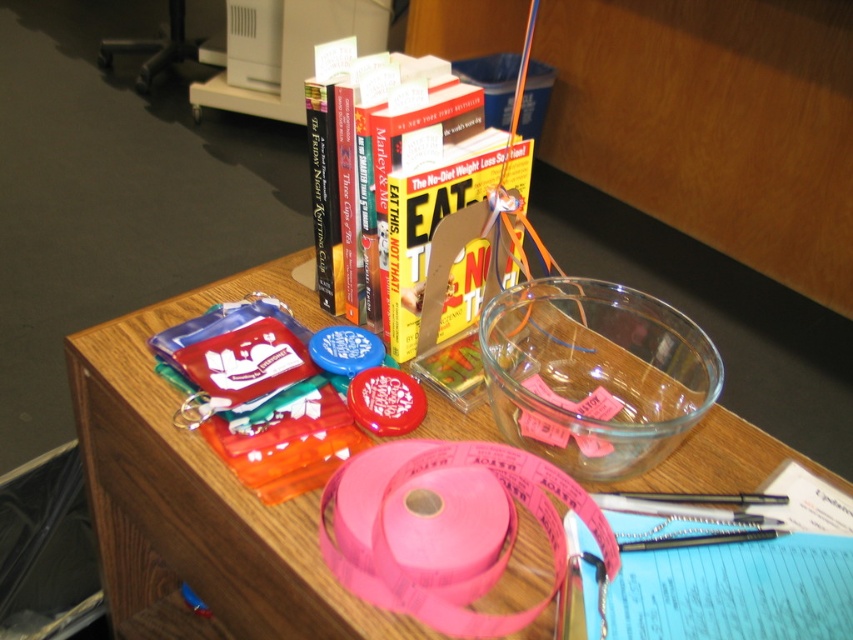
Question: Observing the image, what is the correct spatial positioning of pink plastic tape at center in reference to pink paper ribbon at center?

Choices:
 (A) left
 (B) right

Answer: (A)

Question: Can you confirm if pink paper ribbon at center is thinner than hardcover book at center?

Choices:
 (A) no
 (B) yes

Answer: (A)

Question: Which of these objects is positioned closest to the hardcover book at center?

Choices:
 (A) pink plastic tape at center
 (B) pink paper ribbon at center

Answer: (B)

Question: Which object appears closest to the camera in this image?

Choices:
 (A) transparent glass bowl at center
 (B) pink plastic tape at center

Answer: (B)

Question: Among these points, which one is farthest from the camera?

Choices:
 (A) (424, 548)
 (B) (428, 196)
 (C) (679, 392)
 (D) (148, 582)

Answer: (D)

Question: Is transparent glass bowl at center positioned in front of hardcover book at center?

Choices:
 (A) no
 (B) yes

Answer: (B)